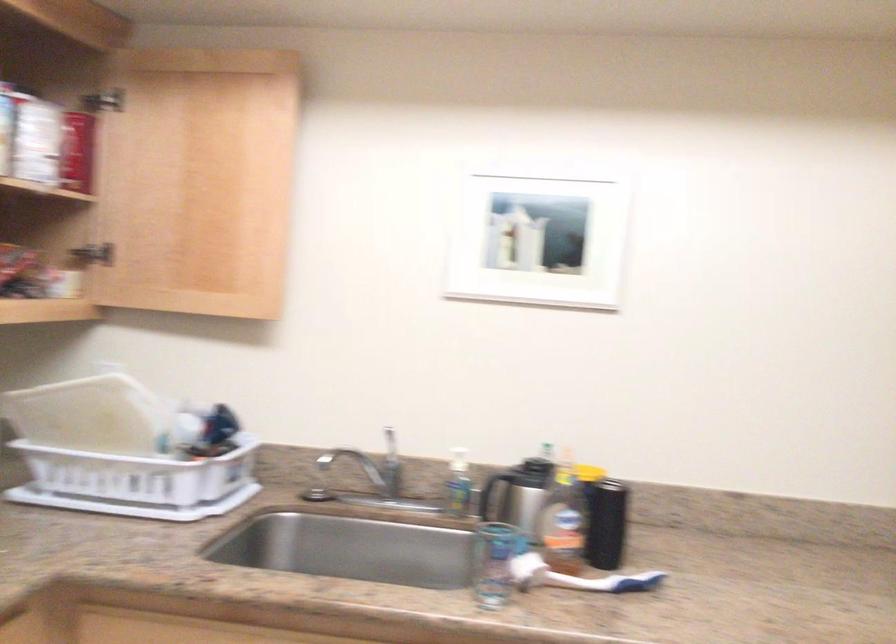
Where would you lift the black beverage can? Please return your answer as a coordinate pair (x, y).

(765, 506)